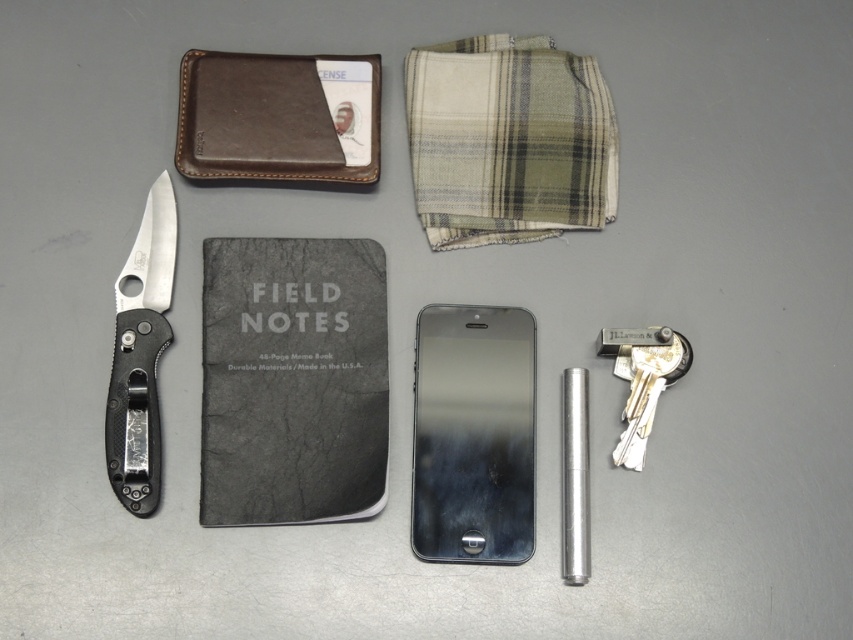
Is point (476, 394) farther from camera compared to point (235, 138)?

No, it is in front of (235, 138).

Does metallic silver phone at center have a lesser width compared to brown leather wallet at upper left?

Indeed, metallic silver phone at center has a lesser width compared to brown leather wallet at upper left.

Image resolution: width=853 pixels, height=640 pixels. What do you see at coordinates (473, 435) in the screenshot?
I see `metallic silver phone at center` at bounding box center [473, 435].

Locate an element on the screen. The width and height of the screenshot is (853, 640). metallic silver phone at center is located at coordinates (473, 435).

Is plaid fabric at upper center further to the viewer compared to polished silver blade at left?

Yes.

Between point (550, 198) and point (141, 499), which one is positioned behind?

Point (550, 198)

Where is `plaid fabric at upper center`? This screenshot has height=640, width=853. plaid fabric at upper center is located at coordinates (508, 140).

Is metallic silver phone at center positioned behind polished silver blade at left?

Yes, metallic silver phone at center is further from the viewer.

Which of these two, metallic silver phone at center or polished silver blade at left, stands shorter?

Standing shorter between the two is metallic silver phone at center.

Image resolution: width=853 pixels, height=640 pixels. Identify the location of metallic silver phone at center. (473, 435).

Image resolution: width=853 pixels, height=640 pixels. I want to click on metallic silver phone at center, so click(x=473, y=435).